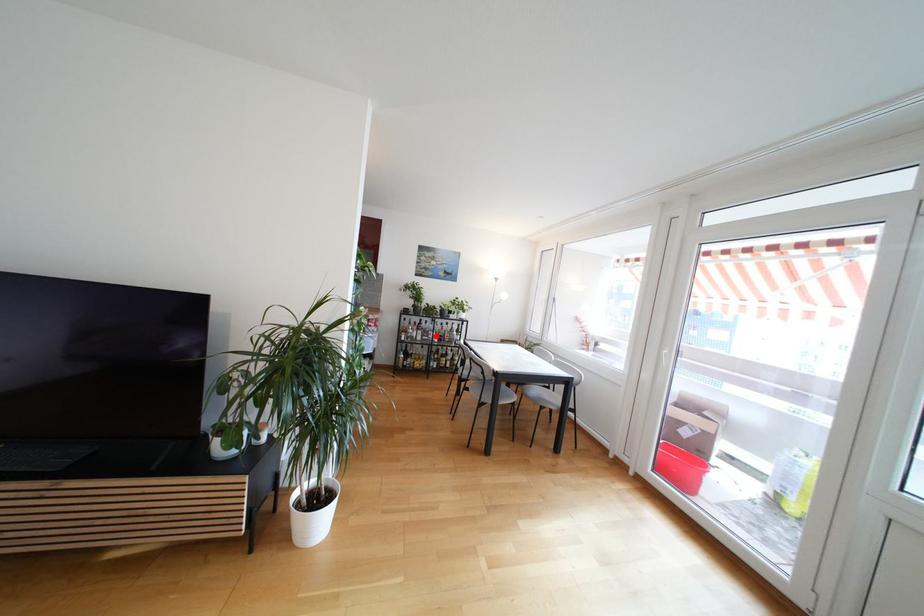
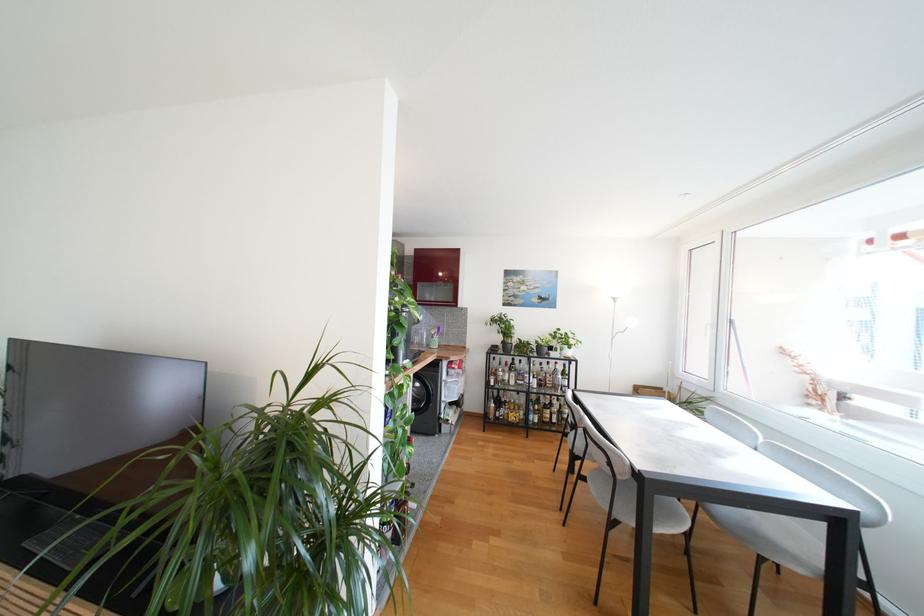
Find the pixel in the second image that matches the highlighted location in the first image.

(532, 379)